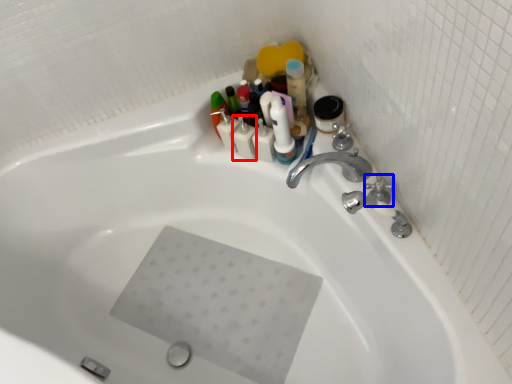
Question: Which object is further to the camera taking this photo, toiletry (highlighted by a red box) or plumbing fixture (highlighted by a blue box)?

Choices:
 (A) toiletry
 (B) plumbing fixture

Answer: (A)